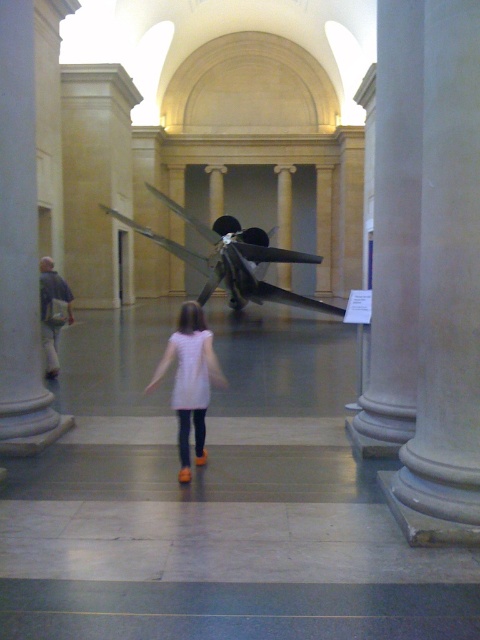
You are a maintenance worker in the gallery and need to reach the smooth gray pillar at right to inspect it. You have a ladder that is 5.5 meters long. Can you safely reach the pillar with your ladder?

The distance between you and the smooth gray pillar at right is 6.07 meters, which is greater than the ladder length of 5.5 meters. Therefore, you cannot safely reach the pillar with the ladder.

You are standing in the center of the room and want to walk towards the smooth gray pillar at right. What are the coordinates of the pillar you need to head towards?

The coordinates of the smooth gray pillar at right are at point (395, 225).

You are an engineer inspecting the structural integrity of the smooth gray pillar at right and the shiny metallic propeller at center. Based on their positions, which object is directly above the other?

The shiny metallic propeller at center is directly above the smooth gray pillar at right because the pillar is positioned under the propeller.